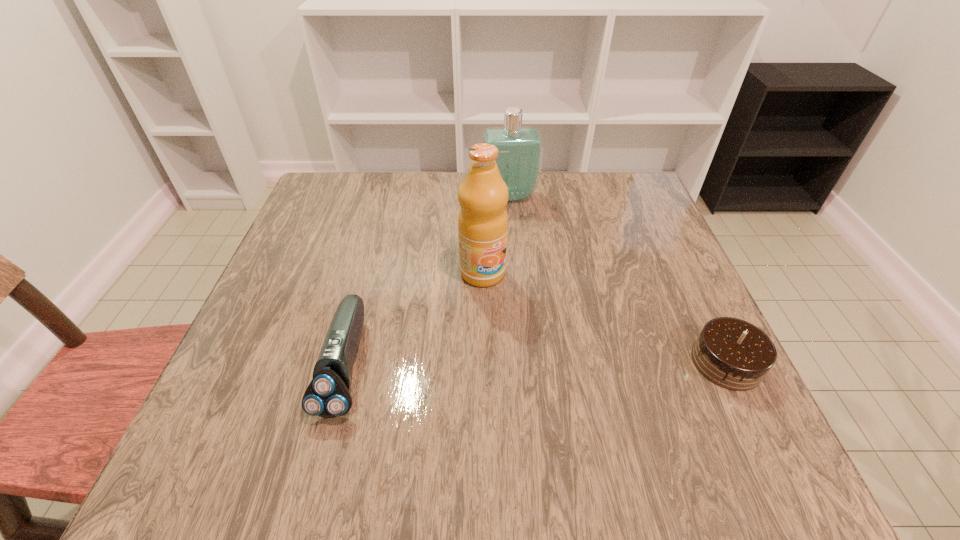
Locate an element on the screen. The height and width of the screenshot is (540, 960). free space located 0.180m on the front label of the tallest object is located at coordinates (540, 346).

You are a GUI agent. You are given a task and a screenshot of the screen. Output one action in this format:
    pyautogui.click(x=<x>, y=<y>)
    Task: Click on the free spot located on the front label of the tallest object
    Image resolution: width=960 pixels, height=540 pixels.
    Given the screenshot: What is the action you would take?
    pyautogui.click(x=550, y=357)

Locate an element on the screen. This screenshot has width=960, height=540. vacant area situated on the front label of the tallest object is located at coordinates (580, 395).

This screenshot has width=960, height=540. Identify the location of object that is at the far edge. (520, 148).

The image size is (960, 540). What are the coordinates of `electric shaver located in the near edge section of the desktop` in the screenshot? It's located at (328, 395).

Image resolution: width=960 pixels, height=540 pixels. Identify the location of chocolate cake present at the near edge. (734, 354).

Where is `object situated at the right edge`? This screenshot has height=540, width=960. object situated at the right edge is located at coordinates (734, 354).

This screenshot has height=540, width=960. I want to click on object present at the near right corner, so click(x=734, y=354).

Identify the location of vacant area at the far edge of the desktop. (581, 176).

Where is `vacant point at the near edge`? Image resolution: width=960 pixels, height=540 pixels. vacant point at the near edge is located at coordinates (641, 381).